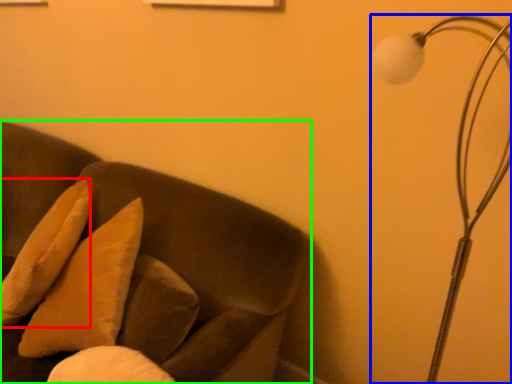
Question: Which is nearer to the pillow (highlighted by a red box)? lamp (highlighted by a blue box) or furniture (highlighted by a green box).

Choices:
 (A) lamp
 (B) furniture

Answer: (B)